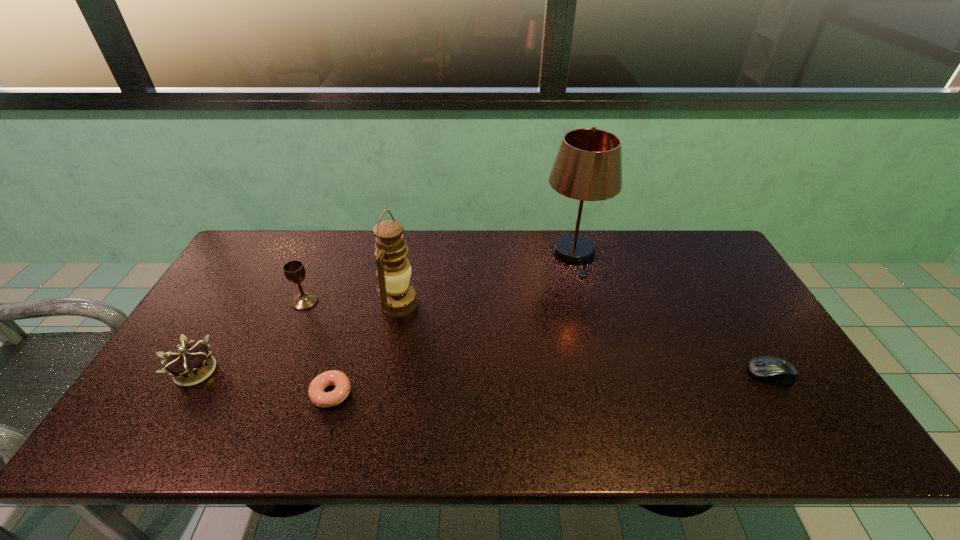
Image resolution: width=960 pixels, height=540 pixels. What are the coordinates of `lampshade` in the screenshot? It's located at pos(588,167).

You are a GUI agent. You are given a task and a screenshot of the screen. Output one action in this format:
    pyautogui.click(x=<x>, y=<y>)
    Task: Click on the tallest object
    The image size is (960, 540).
    Given the screenshot: What is the action you would take?
    pyautogui.click(x=588, y=167)

This screenshot has width=960, height=540. What are the coordinates of `the second tallest object` in the screenshot? It's located at [x=394, y=270].

Find the location of `oil lamp`. oil lamp is located at coordinates (394, 270).

Image resolution: width=960 pixels, height=540 pixels. Find the location of `the second object from left to right`. the second object from left to right is located at coordinates (294, 271).

This screenshot has width=960, height=540. Identify the location of the third tallest object. (294, 271).

At what (x,y) coordinates should I click in order to perform the action: click on the leftmost object. Please return your answer as a coordinate pair (x, y). The image size is (960, 540). Looking at the image, I should click on (188, 366).

You are a GUI agent. You are given a task and a screenshot of the screen. Output one action in this format:
    pyautogui.click(x=<x>, y=<y>)
    Task: Click on the crown
    This screenshot has height=540, width=960.
    Given the screenshot: What is the action you would take?
    pyautogui.click(x=188, y=366)

Where is `mouse`? Image resolution: width=960 pixels, height=540 pixels. mouse is located at coordinates (772, 370).

This screenshot has height=540, width=960. I want to click on the third object from left to right, so (316, 393).